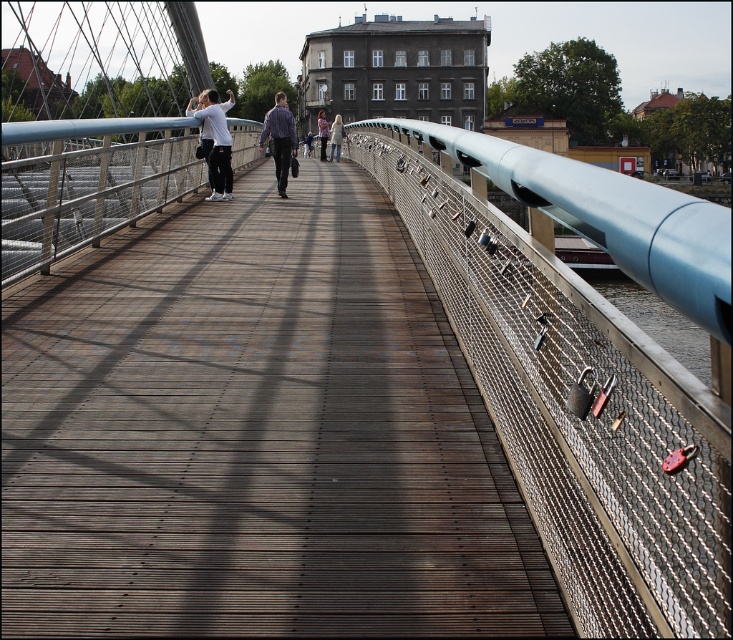
Question: Among these objects, which one is farthest from the camera?

Choices:
 (A) white shirt at left
 (B) white cotton jacket at center
 (C) metallic mesh fence at right

Answer: (B)

Question: Which point is farther from the camera taking this photo?

Choices:
 (A) (327, 136)
 (B) (108, 600)
 (C) (272, 122)

Answer: (A)

Question: Is metallic mesh fence at right smaller than white cotton jacket at center?

Choices:
 (A) yes
 (B) no

Answer: (A)

Question: From the image, what is the correct spatial relationship of white cotton jacket at center in relation to light brown leather jacket at center?

Choices:
 (A) left
 (B) right

Answer: (B)

Question: Can you confirm if metallic mesh fence at right is smaller than white shirt at left?

Choices:
 (A) yes
 (B) no

Answer: (B)

Question: Which point is closer to the camera taking this photo?

Choices:
 (A) (493, 224)
 (B) (210, 100)
 (C) (336, 145)

Answer: (A)